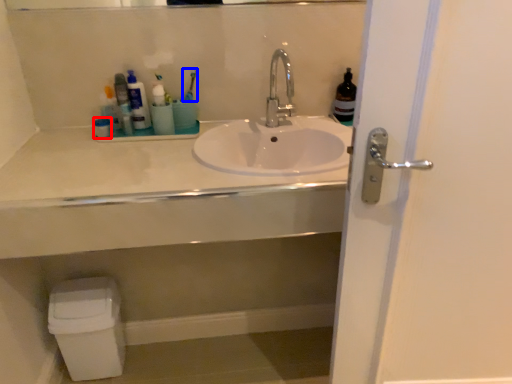
Question: Which point is closer to the camera, toiletry (highlighted by a red box) or toothbrush (highlighted by a blue box)?

Choices:
 (A) toiletry
 (B) toothbrush

Answer: (A)